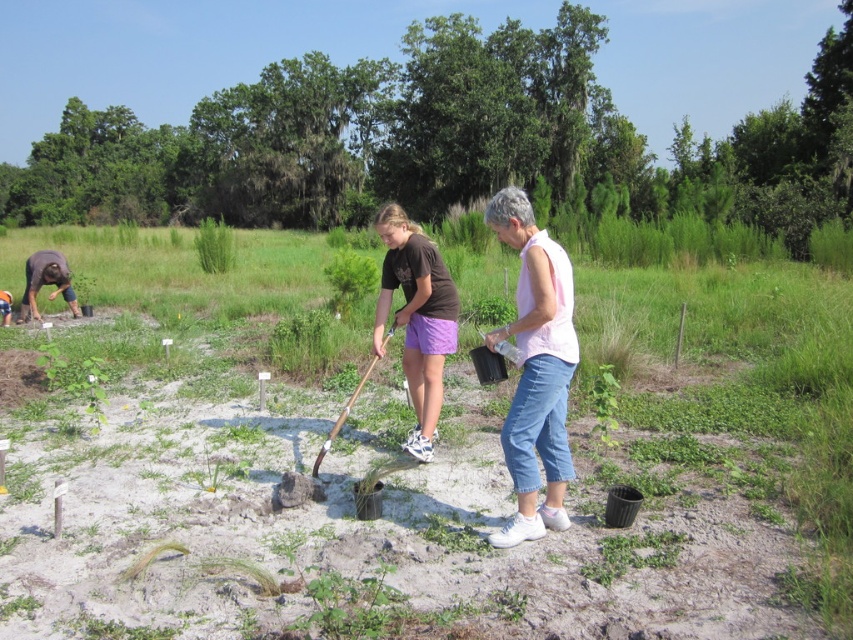
In the scene shown: You are a photographer standing at the edge of the sandy area. You want to take a photo of the pink cotton shirt at center and the green matte plant at lower center. Which object should be placed closer to the camera to ensure both are in focus?

The pink cotton shirt at center is taller than the green matte plant at lower center, so to ensure both are in focus, the shorter green matte plant at lower center should be placed closer to the camera.